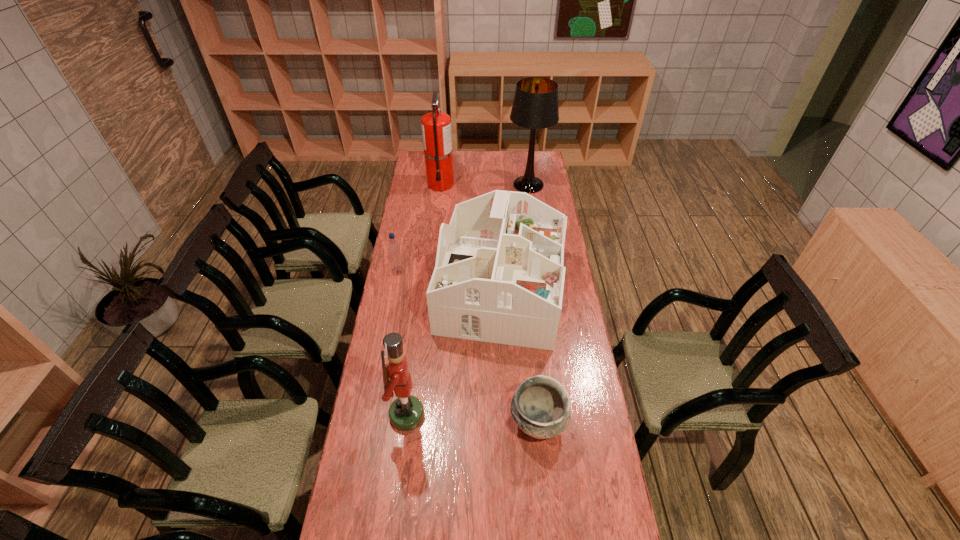
The width and height of the screenshot is (960, 540). In order to click on table lamp in this screenshot , I will do `click(535, 106)`.

Locate an element on the screen. fire extinguisher is located at coordinates (436, 126).

At what (x,y) coordinates should I click in order to perform the action: click on nutcracker. Please return your answer as a coordinate pair (x, y). This screenshot has width=960, height=540. Looking at the image, I should click on (406, 413).

I want to click on dollhouse, so click(x=499, y=276).

I want to click on the second shortest object, so click(x=393, y=248).

This screenshot has width=960, height=540. I want to click on water bottle, so click(x=393, y=248).

The image size is (960, 540). I want to click on the shortest object, so [540, 407].

The image size is (960, 540). I want to click on vacant space located 0.390m on the front of the table lamp, so 537,246.

At what (x,y) coordinates should I click in order to perform the action: click on free space located 0.180m at the nozzle of the fire extinguisher. Please return your answer as a coordinate pair (x, y). The image size is (960, 540). Looking at the image, I should click on 437,215.

Locate an element on the screen. blank space located 0.170m on the front-facing side of the nutcracker is located at coordinates [475, 415].